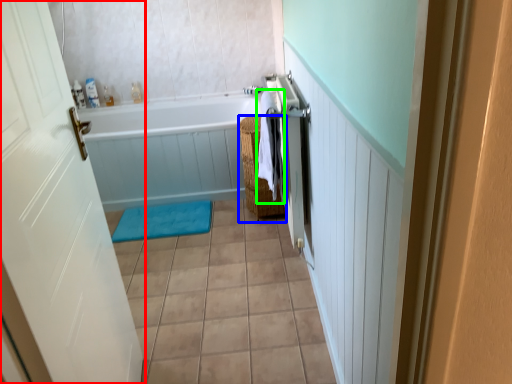
Question: Considering the real-world distances, which object is closest to door (highlighted by a red box)? basket (highlighted by a blue box) or beach towel (highlighted by a green box).

Choices:
 (A) basket
 (B) beach towel

Answer: (B)